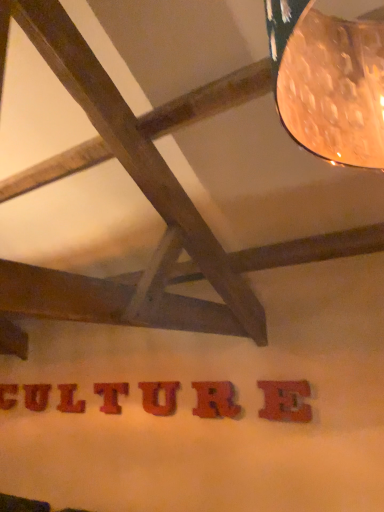
Question: Which direction should I rotate to face red wood letter at center, marked as the second letter in a left-to-right arrangement, — up or down?

Choices:
 (A) up
 (B) down

Answer: (B)

Question: Does red wood letter at lower center, the 1th letter from the left, lie in front of rubberized red letter r at center, the second letter positioned from the front?

Choices:
 (A) yes
 (B) no

Answer: (B)

Question: Is red wood letter at lower center, placed as the 7th letter when sorted from front to back, positioned far away from rubberized red letter r at center, acting as the 6th letter starting from the back?

Choices:
 (A) yes
 (B) no

Answer: (A)

Question: Is red wood letter at lower center, placed as the 7th letter when sorted from front to back, aimed at rubberized red letter r at center, acting as the 6th letter starting from the left?

Choices:
 (A) yes
 (B) no

Answer: (B)

Question: Is red wood letter at lower center, marked as the first letter in a back-to-front arrangement, completely or partially outside of rubberized red letter r at center, acting as the 6th letter starting from the left?

Choices:
 (A) yes
 (B) no

Answer: (A)

Question: Is red wood letter at lower center, the 1th letter from the left, next to rubberized red letter r at center, the second letter positioned from the front, and touching it?

Choices:
 (A) no
 (B) yes

Answer: (A)

Question: Does red wood letter at lower center, the 1th letter from the left, have a greater width compared to rubberized red letter r at center, acting as the 6th letter starting from the back?

Choices:
 (A) yes
 (B) no

Answer: (A)

Question: Is red wood letter at lower center, the 7th letter positioned from the right, surrounded by red wood letter at center, arranged as the 2th letter when viewed from the back?

Choices:
 (A) no
 (B) yes

Answer: (A)

Question: Does red wood letter at center, arranged as the 6th letter when viewed from the right, have a smaller size compared to red wood letter at lower center, the 1th letter from the left?

Choices:
 (A) yes
 (B) no

Answer: (A)

Question: Does red wood letter at center, the sixth letter viewed from the front, lie in front of red wood letter at lower center, the 7th letter positioned from the right?

Choices:
 (A) yes
 (B) no

Answer: (A)

Question: Is red wood letter at center, arranged as the 2th letter when viewed from the back, not close to red wood letter at lower center, the 1th letter from the left?

Choices:
 (A) yes
 (B) no

Answer: (B)

Question: From the image's perspective, is red wood letter at center, marked as the second letter in a left-to-right arrangement, beneath red wood letter at lower center, the 1th letter from the left?

Choices:
 (A) no
 (B) yes

Answer: (A)

Question: Does red wood letter at center, arranged as the 6th letter when viewed from the right, have a larger size compared to red wood letter at lower center, marked as the first letter in a back-to-front arrangement?

Choices:
 (A) no
 (B) yes

Answer: (A)

Question: From the image's perspective, would you say red wood letter at center, which is the 5th letter in right-to-left order, is positioned over wooden textured letter t at center, which appears as the 4th letter when viewed from the left?

Choices:
 (A) yes
 (B) no

Answer: (B)